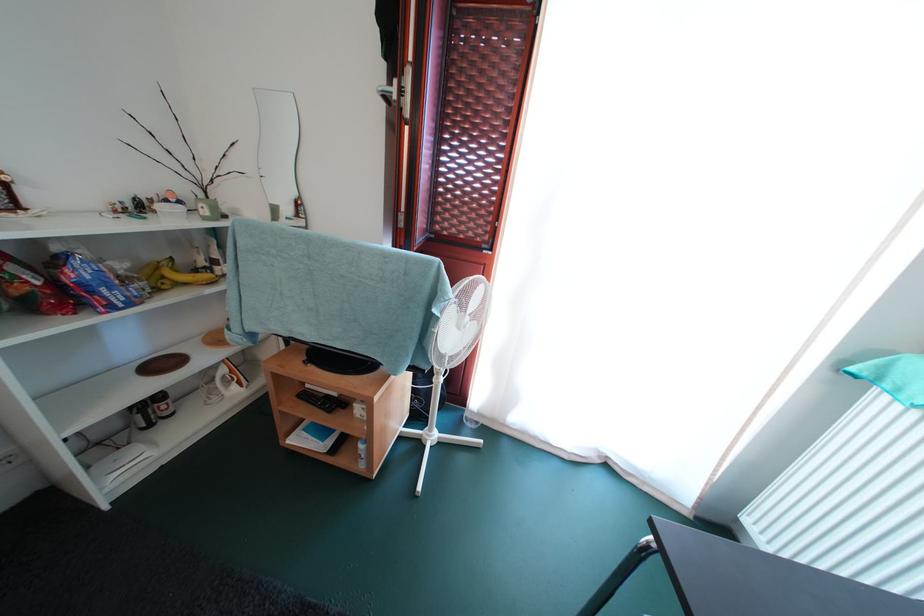
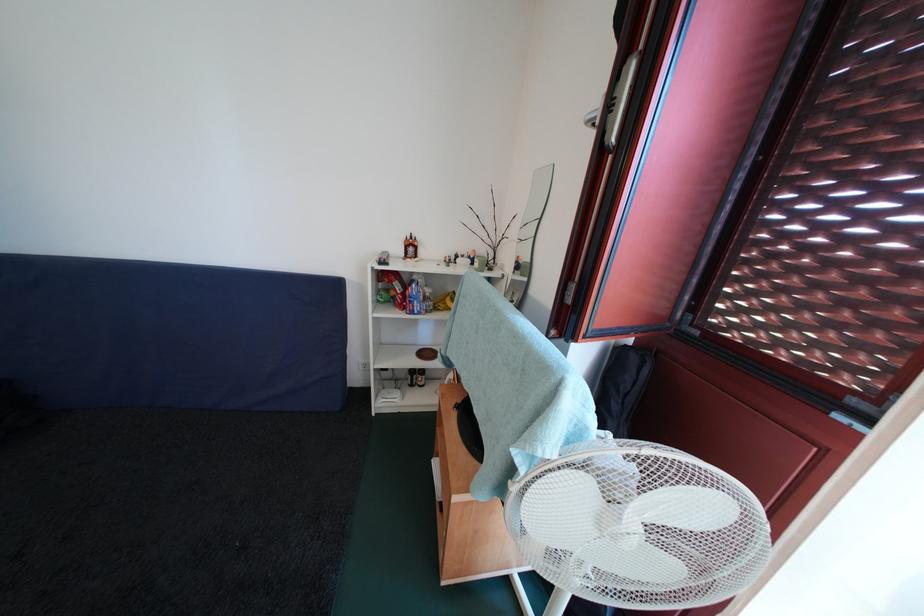
Find the pixel in the second image that matches point 136,270 in the first image.

(438, 296)